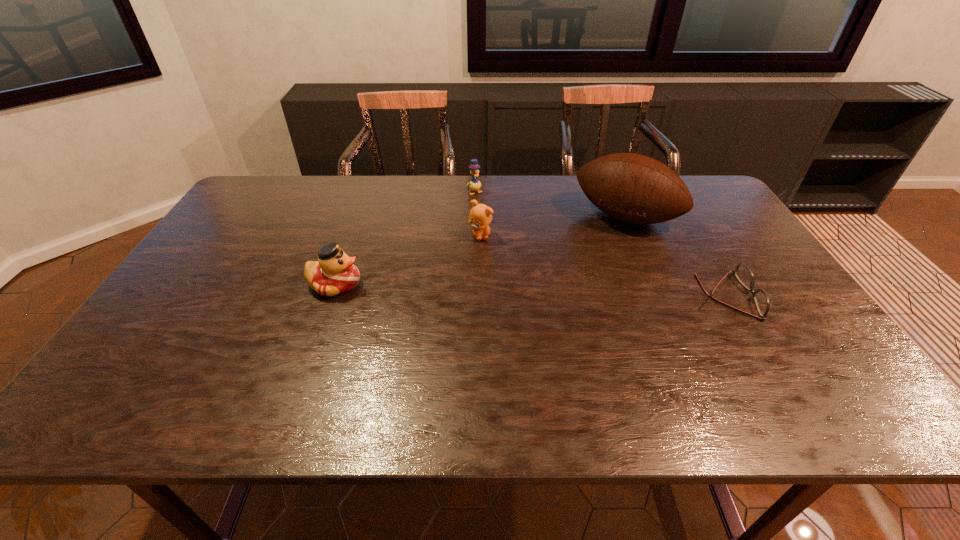
In order to click on duck in this screenshot , I will do `click(334, 273)`.

The image size is (960, 540). Identify the location of the shortest object. (742, 272).

The height and width of the screenshot is (540, 960). Find the location of `the tallest object`. the tallest object is located at coordinates (x=634, y=188).

The width and height of the screenshot is (960, 540). I want to click on the farthest object, so click(475, 184).

Locate an element on the screen. teddy bear is located at coordinates (480, 216).

You are a GUI agent. You are given a task and a screenshot of the screen. Output one action in this format:
    pyautogui.click(x=<x>, y=<y>)
    Task: Click on the vacant space situated 0.280m on the face of the duck
    Image resolution: width=960 pixels, height=540 pixels.
    Given the screenshot: What is the action you would take?
    pyautogui.click(x=466, y=284)

Where is `vacant space situated on the front-facing side of the shortest object`? Image resolution: width=960 pixels, height=540 pixels. vacant space situated on the front-facing side of the shortest object is located at coordinates (777, 296).

I want to click on vacant space located on the laces of the tallest object, so click(599, 248).

Locate an element on the screen. Image resolution: width=960 pixels, height=540 pixels. vacant space situated 0.370m on the laces of the tallest object is located at coordinates (558, 312).

Image resolution: width=960 pixels, height=540 pixels. What are the coordinates of `vacant region located 0.350m on the laces of the tallest object` in the screenshot? It's located at (561, 307).